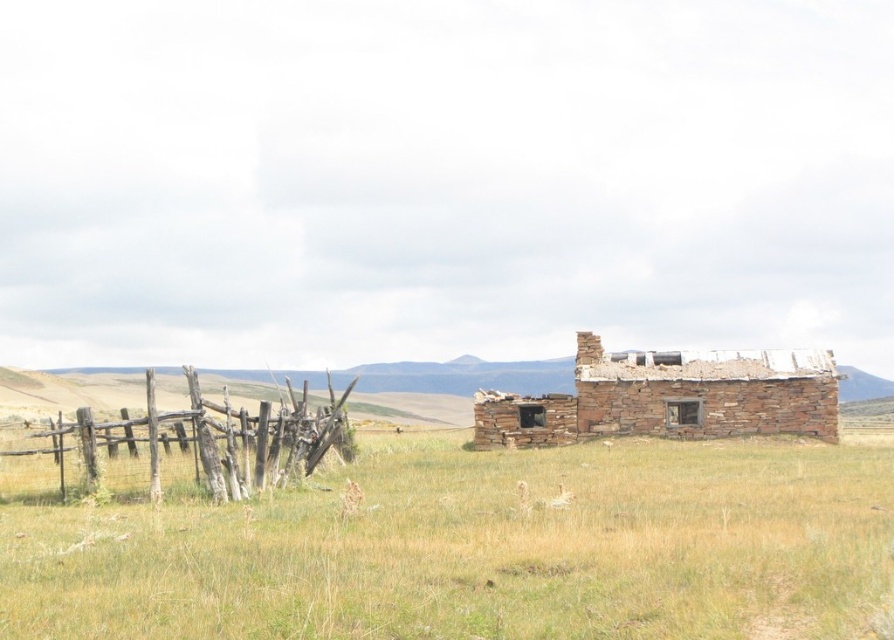
Which of these two, brown grassy field at center or rustic stone hut at right, stands shorter?

With less height is brown grassy field at center.

Is point (673, 572) positioned before point (781, 432)?

That is True.

The width and height of the screenshot is (894, 640). What do you see at coordinates (481, 548) in the screenshot?
I see `brown grassy field at center` at bounding box center [481, 548].

In order to click on brown grassy field at center in this screenshot , I will do `click(481, 548)`.

Does brown grassy field at center appear on the left side of weathered wood fence at left?

In fact, brown grassy field at center is to the right of weathered wood fence at left.

Does point (26, 529) lie behind point (339, 424)?

No, it is not.

Measure the distance between point (810, 465) and camera.

The distance of point (810, 465) from camera is 48.40 meters.

This screenshot has width=894, height=640. Identify the location of brown grassy field at center. (481, 548).

Who is lower down, rustic stone hut at right or weathered wood fence at left?

Positioned lower is weathered wood fence at left.

Between point (639, 403) and point (346, 456), which one is positioned in front?

Point (346, 456)

Locate an element on the screen. Image resolution: width=894 pixels, height=640 pixels. rustic stone hut at right is located at coordinates [668, 397].